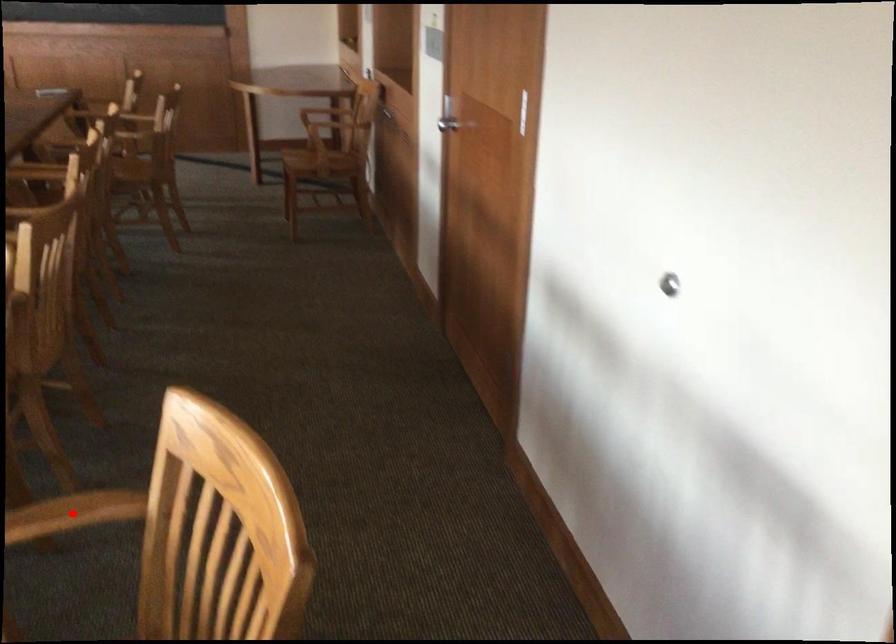
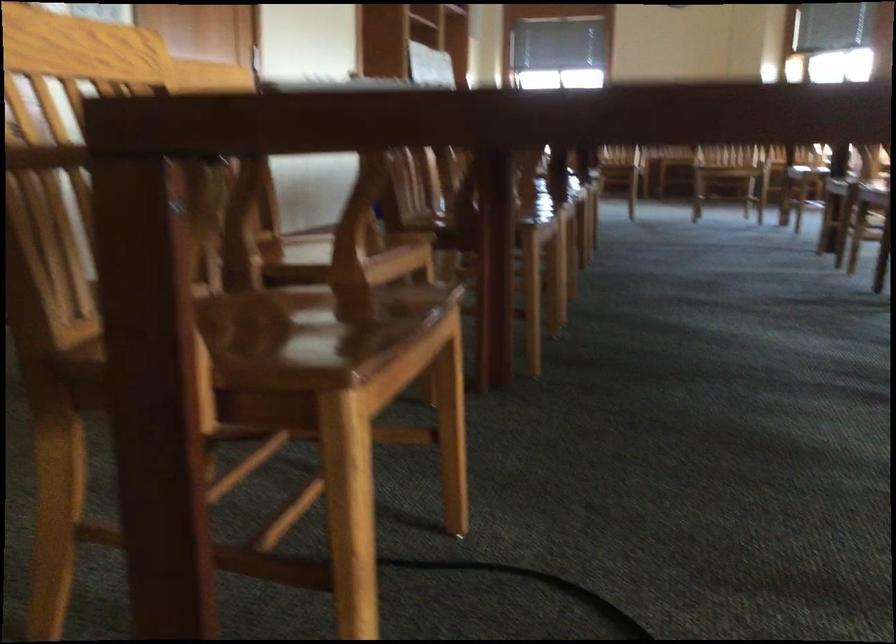
Question: I am providing you with two images of the same scene from different viewpoints. A red point is marked on the first image. Can you still see the location of the red point in image 2?

Choices:
 (A) Yes
 (B) No

Answer: (B)